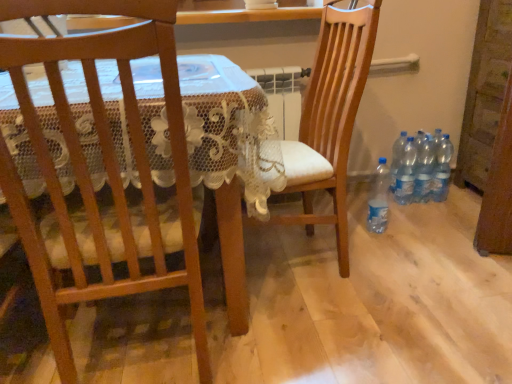
Find the location of a particular element. clear plastic bottles at lower right, placed as the fourth bottle when sorted from right to left is located at coordinates (397, 158).

Based on the photo, in order to face clear plastic bottles at lower right, the third bottle from the left, should I rotate leftwards or rightwards?

A 19.196 degree turn to the right will do.

What is the approximate width of wooden chair at center, the 2th chair from the left?

The width of wooden chair at center, the 2th chair from the left, is 22.78 inches.

Locate an element on the screen. Image resolution: width=512 pixels, height=384 pixels. clear plastic bottle at lower right, which appears as the 1th bottle when viewed from the left is located at coordinates (378, 199).

Find the location of a particular element. clear plastic bottles at lower right, acting as the 2th bottle starting from the right is located at coordinates (424, 170).

Is clear plastic bottle at lower right, which appears as the 5th bottle when viewed from the right, oriented towards clear plastic bottles at lower right, which is counted as the 4th bottle, starting from the left?

No, clear plastic bottle at lower right, which appears as the 5th bottle when viewed from the right, is not facing towards clear plastic bottles at lower right, which is counted as the 4th bottle, starting from the left.

Which object is positioned more to the right, clear plastic bottle at lower right, which appears as the 1th bottle when viewed from the left, or clear plastic bottles at lower right, acting as the 2th bottle starting from the right?

From the viewer's perspective, clear plastic bottles at lower right, acting as the 2th bottle starting from the right, appears more on the right side.

Is clear plastic bottle at lower right, which appears as the 5th bottle when viewed from the right, with clear plastic bottles at lower right, which is counted as the 4th bottle, starting from the left?

No, clear plastic bottle at lower right, which appears as the 5th bottle when viewed from the right, is not next to clear plastic bottles at lower right, which is counted as the 4th bottle, starting from the left.

Between clear plastic bottle at lower right, which appears as the 1th bottle when viewed from the left, and clear plastic bottles at lower right, acting as the 2th bottle starting from the right, which one has less height?

clear plastic bottle at lower right, which appears as the 1th bottle when viewed from the left, is shorter.

The width and height of the screenshot is (512, 384). Identify the location of the 1st chair in front of the clear plastic bottles at lower right, the 2th bottle when ordered from left to right, starting your count from the anchor. (331, 117).

Consider the image. From their relative heights in the image, would you say clear plastic bottles at lower right, placed as the fourth bottle when sorted from right to left, is taller or shorter than wooden chair at center, the 2th chair from the left?

Clearly, clear plastic bottles at lower right, placed as the fourth bottle when sorted from right to left, is shorter compared to wooden chair at center, the 2th chair from the left.

Is clear plastic bottles at lower right, the 2th bottle when ordered from left to right, looking in the opposite direction of wooden chair at center, which is counted as the 1th chair, starting from the right?

No.

From the image's perspective, which object appears higher, clear plastic bottles at lower right, the 2th bottle when ordered from left to right, or wooden chair at center, the 2th chair from the left?

wooden chair at center, the 2th chair from the left, appears higher in the image.

Considering the relative positions of wooden chair at center, which is counted as the 1th chair, starting from the right, and clear plastic bottles at lower right, the 5th bottle positioned from the left, in the image provided, is wooden chair at center, which is counted as the 1th chair, starting from the right, to the right of clear plastic bottles at lower right, the 5th bottle positioned from the left, from the viewer's perspective?

No.

From a real-world perspective, is wooden chair at center, the 2th chair from the left, below clear plastic bottles at lower right, the 5th bottle positioned from the left?

No, from a real-world perspective, wooden chair at center, the 2th chair from the left, is not below clear plastic bottles at lower right, the 5th bottle positioned from the left.

Is wooden chair at center, which is counted as the 1th chair, starting from the right, located outside clear plastic bottles at lower right, which is the 1th bottle from right to left?

Absolutely, wooden chair at center, which is counted as the 1th chair, starting from the right, is external to clear plastic bottles at lower right, which is the 1th bottle from right to left.

Who is bigger, clear plastic bottle at lower right, which appears as the 1th bottle when viewed from the left, or clear plastic bottles at lower right, the 5th bottle positioned from the left?

clear plastic bottles at lower right, the 5th bottle positioned from the left.

Is clear plastic bottle at lower right, which appears as the 1th bottle when viewed from the left, facing away from clear plastic bottles at lower right, the 5th bottle positioned from the left?

No, clear plastic bottle at lower right, which appears as the 1th bottle when viewed from the left,'s orientation is not away from clear plastic bottles at lower right, the 5th bottle positioned from the left.

Is clear plastic bottle at lower right, which appears as the 5th bottle when viewed from the right, taller or shorter than clear plastic bottles at lower right, the 5th bottle positioned from the left?

clear plastic bottle at lower right, which appears as the 5th bottle when viewed from the right, is shorter than clear plastic bottles at lower right, the 5th bottle positioned from the left.

Is clear plastic bottle at lower right, which appears as the 1th bottle when viewed from the left, outside of clear plastic bottles at lower right, the 5th bottle positioned from the left?

Yes, clear plastic bottle at lower right, which appears as the 1th bottle when viewed from the left, is outside of clear plastic bottles at lower right, the 5th bottle positioned from the left.

Is clear plastic bottles at lower right, the 3th bottle from the right, outside of wooden chair at left, which appears as the first chair when viewed from the left?

Yes, clear plastic bottles at lower right, the 3th bottle from the right, is located beyond the bounds of wooden chair at left, which appears as the first chair when viewed from the left.

From the image's perspective, is clear plastic bottles at lower right, the 3th bottle from the right, located above wooden chair at left, which appears as the first chair when viewed from the left?

Yes, from the image's perspective, clear plastic bottles at lower right, the 3th bottle from the right, is over wooden chair at left, which appears as the first chair when viewed from the left.

From a real-world perspective, is clear plastic bottles at lower right, the 3th bottle from the right, below wooden chair at left, which appears as the first chair when viewed from the left?

Yes.

Considering the points (400, 198) and (35, 134), which point is behind, point (400, 198) or point (35, 134)?

The point (400, 198) is behind.

Locate an element on the screen. The image size is (512, 384). the 1st chair located above the clear plastic bottles at lower right, the 5th bottle positioned from the left (from a real-world perspective) is located at coordinates (331, 117).

Does clear plastic bottles at lower right, the 5th bottle positioned from the left, turn towards wooden chair at center, the 2th chair from the left?

No.

Does clear plastic bottles at lower right, which is the 1th bottle from right to left, have a greater width compared to wooden chair at center, the 2th chair from the left?

Incorrect, the width of clear plastic bottles at lower right, which is the 1th bottle from right to left, does not surpass that of wooden chair at center, the 2th chair from the left.

Considering the positions of objects wooden chair at center, which is counted as the 1th chair, starting from the right, and clear plastic bottles at lower right, acting as the 2th bottle starting from the right, in the image provided, who is more to the left, wooden chair at center, which is counted as the 1th chair, starting from the right, or clear plastic bottles at lower right, acting as the 2th bottle starting from the right,?

wooden chair at center, which is counted as the 1th chair, starting from the right.

In the scene shown: In terms of height, does wooden chair at center, the 2th chair from the left, look taller or shorter compared to clear plastic bottles at lower right, which is counted as the 4th bottle, starting from the left?

Considering their sizes, wooden chair at center, the 2th chair from the left, has more height than clear plastic bottles at lower right, which is counted as the 4th bottle, starting from the left.

Could you tell me if wooden chair at center, the 2th chair from the left, is facing clear plastic bottles at lower right, which is counted as the 4th bottle, starting from the left?

No, wooden chair at center, the 2th chair from the left, is not aimed at clear plastic bottles at lower right, which is counted as the 4th bottle, starting from the left.

From a real-world perspective, which object stands above the other?

In real-world perspective, wooden chair at center, which is counted as the 1th chair, starting from the right, is above.

Locate an element on the screen. The width and height of the screenshot is (512, 384). the 2nd bottle in front of the clear plastic bottles at lower right, which is counted as the 4th bottle, starting from the left, counting from the anchor's position is located at coordinates (378, 199).

Image resolution: width=512 pixels, height=384 pixels. Identify the location of the 4th bottle below the wooden chair at center, which is counted as the 1th chair, starting from the right (from a real-world perspective). (397, 158).

Based on their spatial positions, is clear plastic bottles at lower right, acting as the 2th bottle starting from the right, or wooden chair at center, the 2th chair from the left, further from clear plastic bottles at lower right, the 5th bottle positioned from the left?

Among the two, wooden chair at center, the 2th chair from the left, is located further to clear plastic bottles at lower right, the 5th bottle positioned from the left.

Estimate the real-world distances between objects in this image. Which object is further from wooden chair at center, the 2th chair from the left, clear plastic bottle at lower right, which appears as the 5th bottle when viewed from the right, or clear plastic bottles at lower right, the third bottle from the left?

clear plastic bottles at lower right, the third bottle from the left, lies further to wooden chair at center, the 2th chair from the left, than the other object.

Looking at this image, when comparing their distances from clear plastic bottles at lower right, placed as the fourth bottle when sorted from right to left, does clear plastic bottles at lower right, the third bottle from the left, or wooden chair at center, which is counted as the 1th chair, starting from the right, seem closer?

clear plastic bottles at lower right, the third bottle from the left, is closer to clear plastic bottles at lower right, placed as the fourth bottle when sorted from right to left.

Which object lies nearer to the anchor point clear plastic bottles at lower right, the third bottle from the left, clear plastic bottle at lower right, which appears as the 1th bottle when viewed from the left, or clear plastic bottles at lower right, which is the 1th bottle from right to left?

clear plastic bottles at lower right, which is the 1th bottle from right to left, is positioned closer to the anchor clear plastic bottles at lower right, the third bottle from the left.

From the image, which object appears to be farther from clear plastic bottles at lower right, placed as the fourth bottle when sorted from right to left, clear plastic bottles at lower right, acting as the 2th bottle starting from the right, or clear plastic bottle at lower right, which appears as the 5th bottle when viewed from the right?

Among the two, clear plastic bottle at lower right, which appears as the 5th bottle when viewed from the right, is located further to clear plastic bottles at lower right, placed as the fourth bottle when sorted from right to left.

Consider the image. Considering their positions, is clear plastic bottles at lower right, which is the 1th bottle from right to left, positioned further to wooden chair at center, the 2th chair from the left, than clear plastic bottle at lower right, which appears as the 1th bottle when viewed from the left?

The object further to wooden chair at center, the 2th chair from the left, is clear plastic bottles at lower right, which is the 1th bottle from right to left.

Based on their spatial positions, is clear plastic bottles at lower right, the 5th bottle positioned from the left, or clear plastic bottles at lower right, the 2th bottle when ordered from left to right, further from clear plastic bottle at lower right, which appears as the 5th bottle when viewed from the right?

The object further to clear plastic bottle at lower right, which appears as the 5th bottle when viewed from the right, is clear plastic bottles at lower right, the 5th bottle positioned from the left.

From the picture: Based on their spatial positions, is clear plastic bottles at lower right, the third bottle from the left, or clear plastic bottles at lower right, the 5th bottle positioned from the left, further from clear plastic bottle at lower right, which appears as the 1th bottle when viewed from the left?

clear plastic bottles at lower right, the 5th bottle positioned from the left, lies further to clear plastic bottle at lower right, which appears as the 1th bottle when viewed from the left, than the other object.

The image size is (512, 384). Find the location of `chair between wooden chair at left, the 2th chair in the right-to-left sequence, and clear plastic bottles at lower right, the 5th bottle positioned from the left, in the front-back direction`. chair between wooden chair at left, the 2th chair in the right-to-left sequence, and clear plastic bottles at lower right, the 5th bottle positioned from the left, in the front-back direction is located at coordinates (331, 117).

Locate an element on the screen. The height and width of the screenshot is (384, 512). chair between wooden chair at left, the 2th chair in the right-to-left sequence, and clear plastic bottles at lower right, the 2th bottle when ordered from left to right, along the z-axis is located at coordinates (331, 117).

Find the location of a particular element. This screenshot has width=512, height=384. chair positioned between wooden chair at left, which appears as the first chair when viewed from the left, and clear plastic bottles at lower right, the third bottle from the left, from near to far is located at coordinates (331, 117).

Find the location of a particular element. The width and height of the screenshot is (512, 384). bottle located between clear plastic bottles at lower right, the 3th bottle from the right, and clear plastic bottles at lower right, which is the 1th bottle from right to left, in the left-right direction is located at coordinates (424, 170).